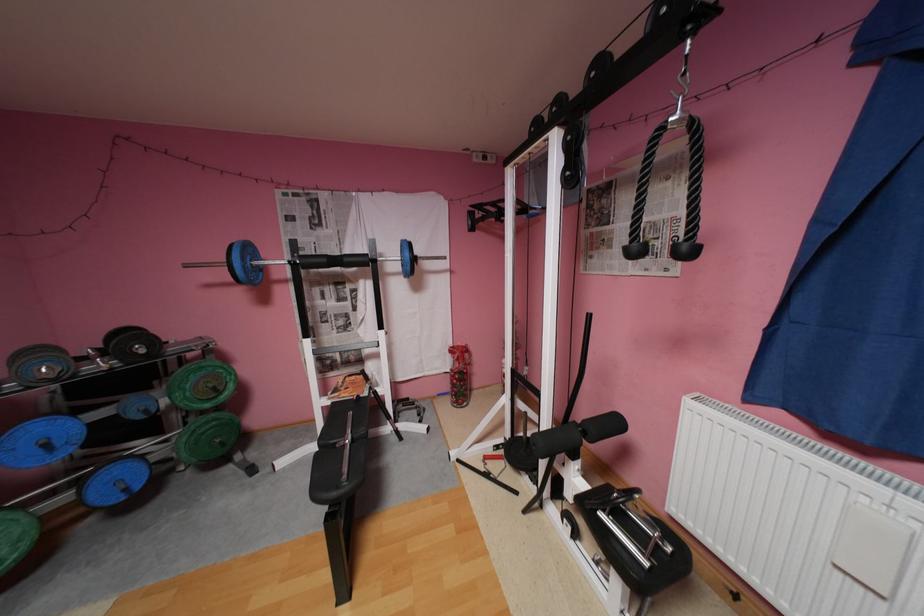
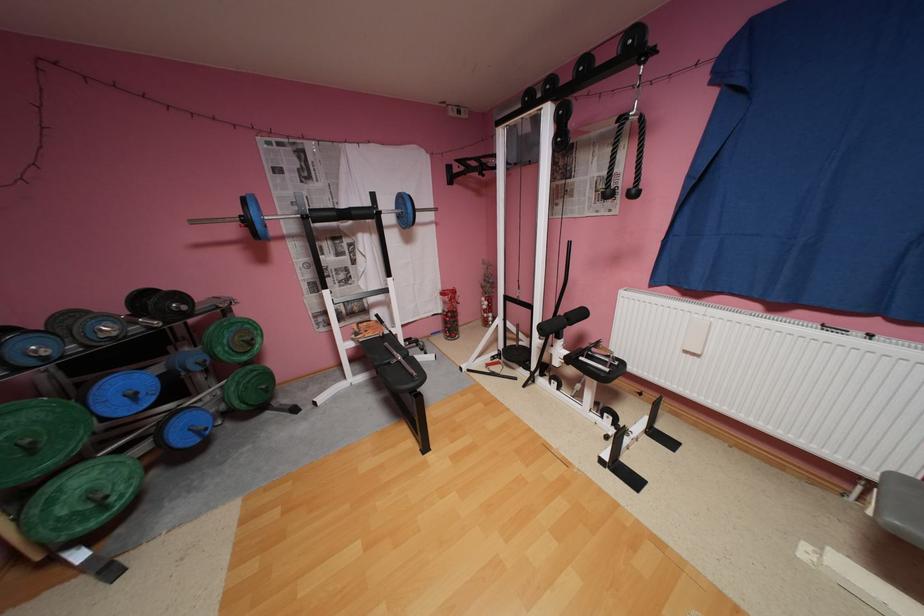
Where in the second image is the point corresponding to [55,445] from the first image?

(142, 395)